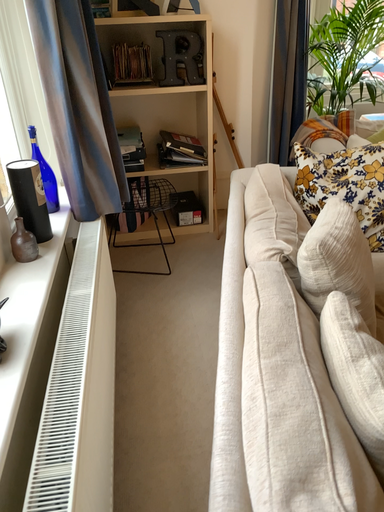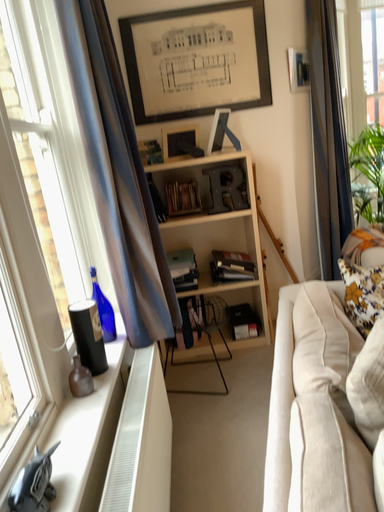
Question: Which way did the camera rotate in the video?

Choices:
 (A) rotated left
 (B) rotated right

Answer: (A)